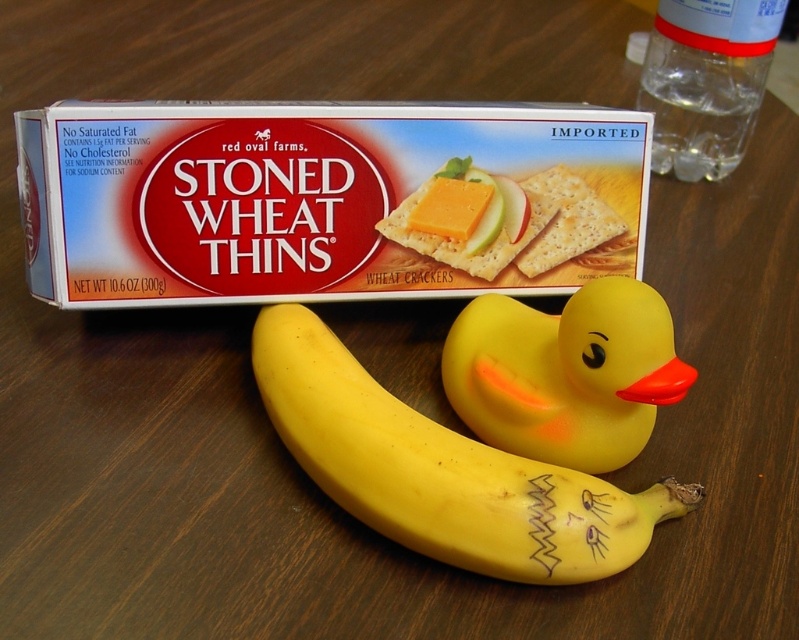
Question: Does transparent plastic bottle at upper right appear on the right side of yellow cheese at center?

Choices:
 (A) no
 (B) yes

Answer: (B)

Question: Is the position of yellow matte banana at center more distant than that of yellow rubber duck at center?

Choices:
 (A) yes
 (B) no

Answer: (B)

Question: Which object is the farthest from the yellow cheese at center?

Choices:
 (A) yellow matte banana at center
 (B) yellow rubber duck at center

Answer: (A)

Question: Which of the following is the farthest from the observer?

Choices:
 (A) yellow rubber duck at center
 (B) transparent plastic bottle at upper right
 (C) yellow matte banana at center
 (D) yellow cheese at center

Answer: (D)

Question: Considering the real-world distances, which object is closest to the yellow cheese at center?

Choices:
 (A) yellow rubber duck at center
 (B) transparent plastic bottle at upper right
 (C) yellow matte banana at center

Answer: (A)

Question: Is yellow rubber duck at center wider than yellow cheese at center?

Choices:
 (A) yes
 (B) no

Answer: (A)